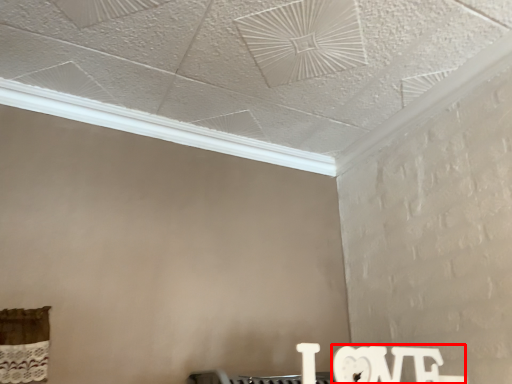
Question: From the image's perspective, what is the correct spatial positioning of writing (annotated by the red box) in reference to window?

Choices:
 (A) above
 (B) below

Answer: (B)